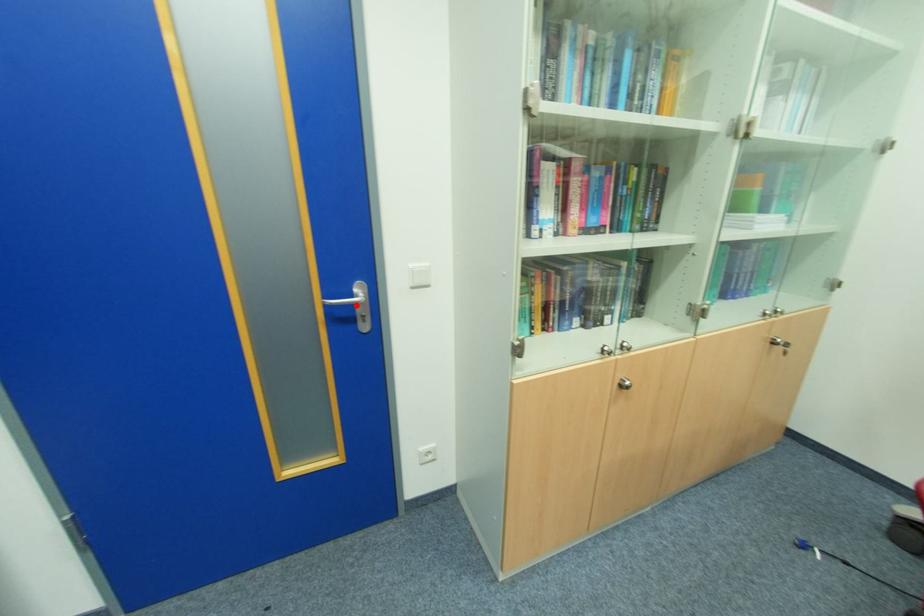
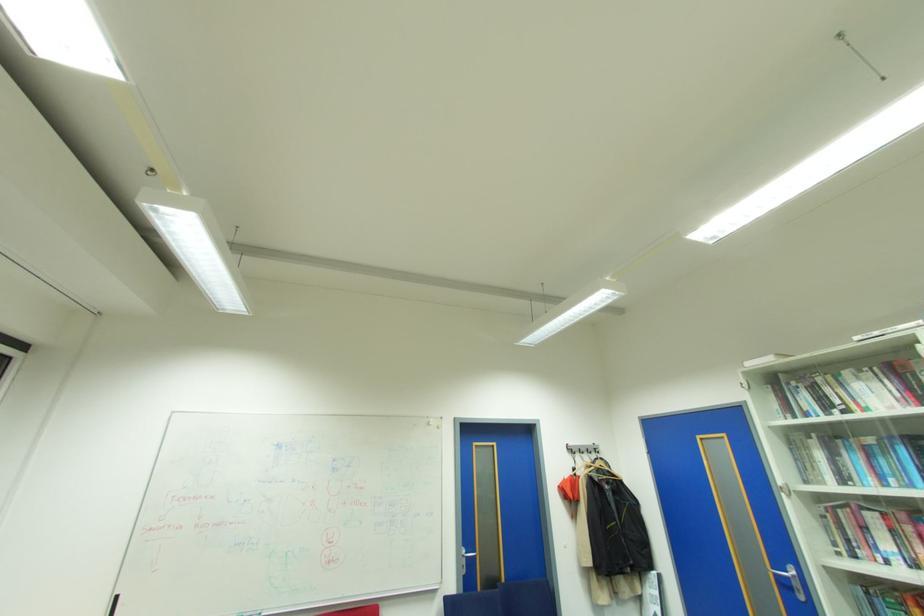
Where in the second image is the point corresponding to the highlighted location from the first image?

(791, 578)